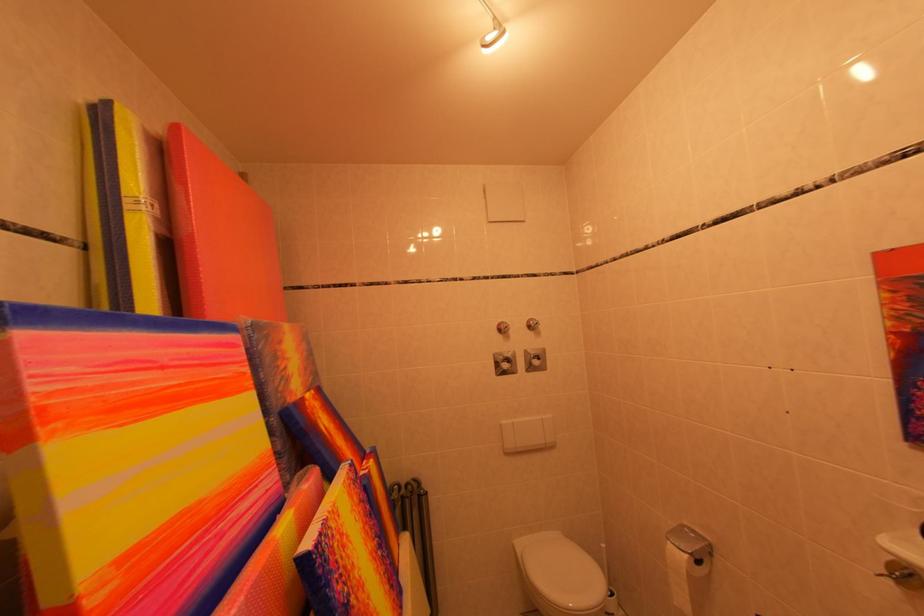
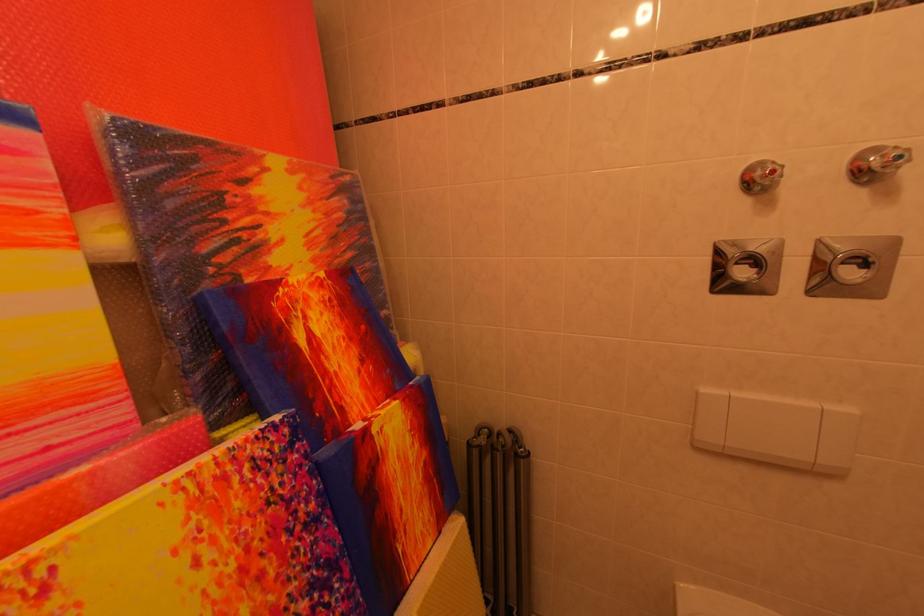
Where in the second image is the point corresponding to (515,369) from the first image?

(751, 277)